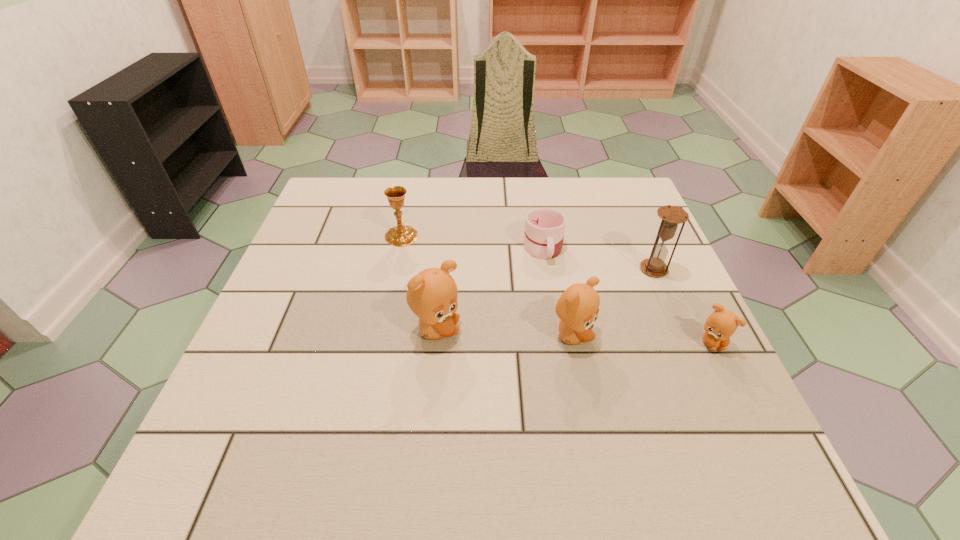
Where is `the closest teddy bear relative to the rightmost teddy bear`? The image size is (960, 540). the closest teddy bear relative to the rightmost teddy bear is located at coordinates (577, 308).

Select which teddy bear appears as the closest to the leftmost teddy bear. Please provide its 2D coordinates. Your answer should be formatted as a tuple, i.e. [(x, y)], where the tuple contains the x and y coordinates of a point satisfying the conditions above.

[(577, 308)]

The image size is (960, 540). I want to click on vacant space that satisfies the following two spatial constraints: 1. on the side with the handle of the hourglass; 2. on the right side of the mug, so click(x=547, y=269).

At what (x,y) coordinates should I click in order to perform the action: click on free spot that satisfies the following two spatial constraints: 1. on the front side of the chalice; 2. on the right side of the hourglass. Please return your answer as a coordinate pair (x, y). The width and height of the screenshot is (960, 540). Looking at the image, I should click on (395, 269).